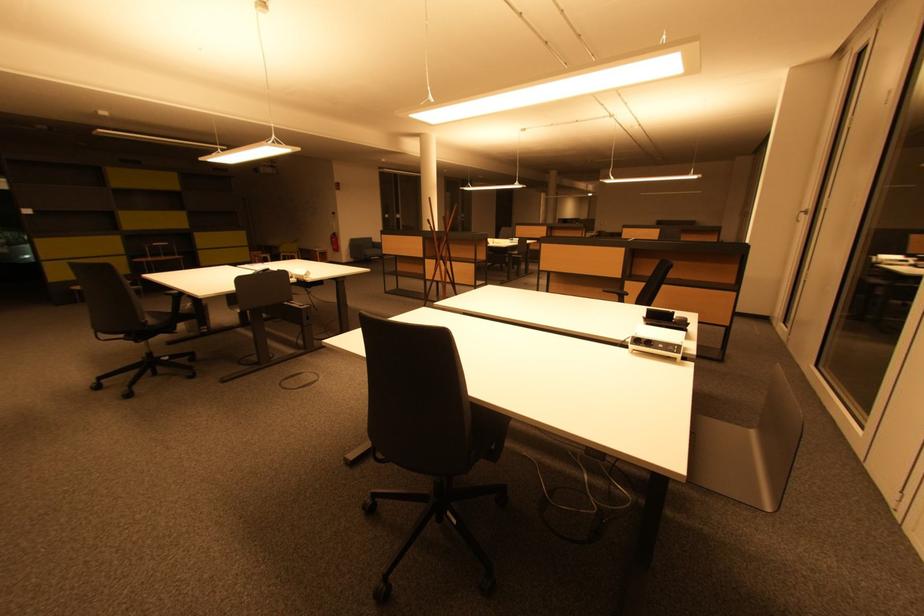
The width and height of the screenshot is (924, 616). What do you see at coordinates (801, 215) in the screenshot?
I see `a silver window handle` at bounding box center [801, 215].